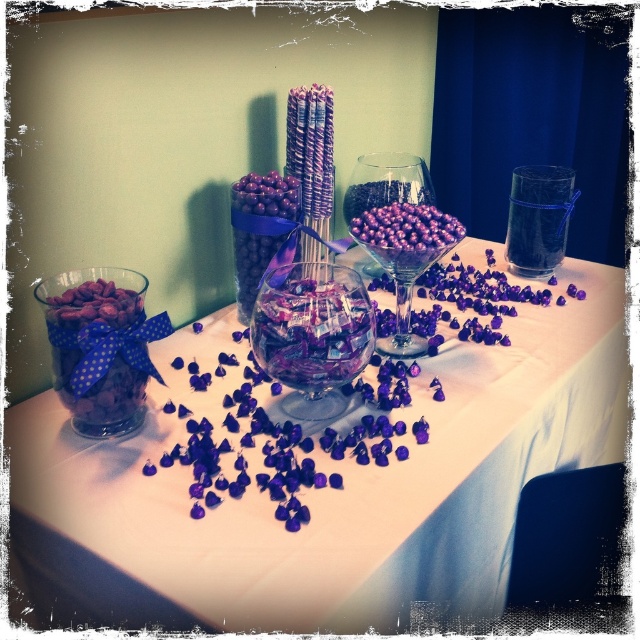
You are planning to fill the transparent glass bowl at center and the purple glossy chocolate at center with candies. Which container can hold more candies based on their sizes?

The transparent glass bowl at center has a larger size compared to the purple glossy chocolate at center, so it can hold more candies.

You are a guest at a party and want to grab a purple glossy chocolate at center from the table. The transparent glass bowl at center is in your way. Can you reach the chocolate without moving the bowl?

The transparent glass bowl at center is closer to the viewer than the purple glossy chocolate at center, so you would need to move the bowl to access the chocolate.